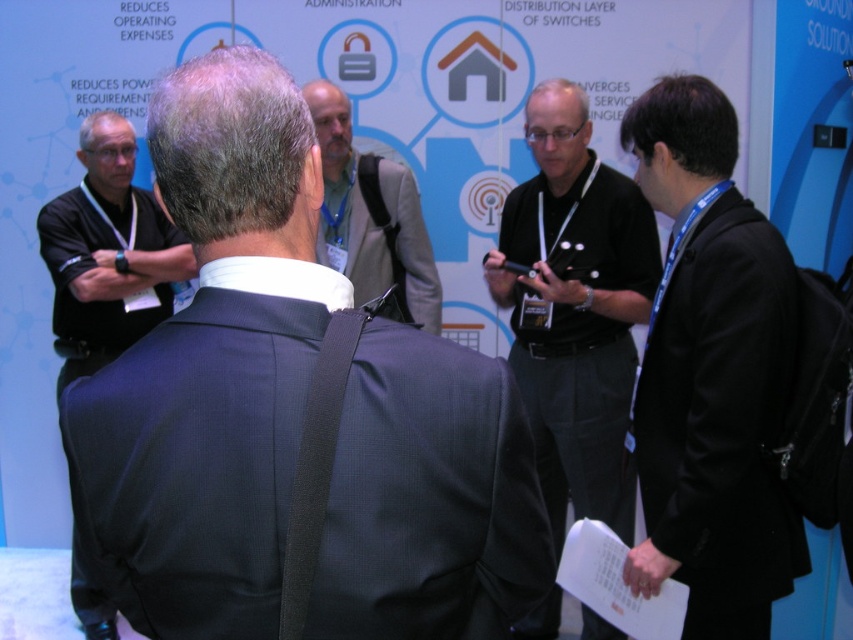
You are attending a trade show and want to approach the person in the dark gray suit at center to ask about the display board. However, there is a narrow pathway between them and the black fabric suit at right. Can you walk through this path without needing to move either person?

The dark gray suit at center is closer to the viewer than the black fabric suit at right, so the path between them is narrow but passable. You can walk through the path without needing to move either person as the distance between them allows for passage.

You are a photographer standing at the event. You want to take a photo of the black shirt at center without including the large display board in the background. Given that the display board is behind the person, how far back should you position yourself to ensure the board is out of frame?

To avoid including the large display board in the background, you should position yourself at least 2.24 meters away from the black shirt at center, maintaining that distance to ensure the board remains out of the frame.

You are a photographer at a trade show and need to position two individuals wearing suits in the foreground. The scene has a large display board in the background with technical information. You want to ensure the person in the dark gray suit at center is not obscured by the other person. Given their heights, which suit should stand closer to the camera?

The dark gray suit at center is shorter than the gray suit at center. To prevent the shorter person from being obscured, the dark gray suit at center should stand closer to the camera.